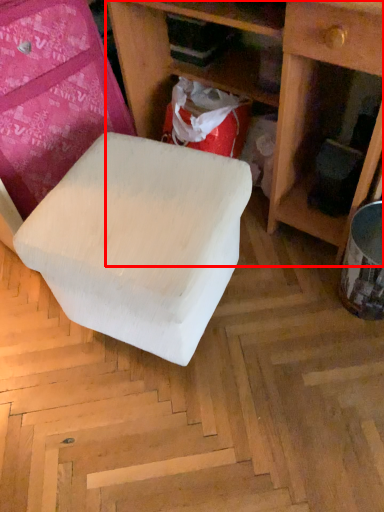
Question: Considering the relative positions of shelf (annotated by the red box) and furniture in the image provided, where is shelf (annotated by the red box) located with respect to the staircase?

Choices:
 (A) right
 (B) left

Answer: (A)